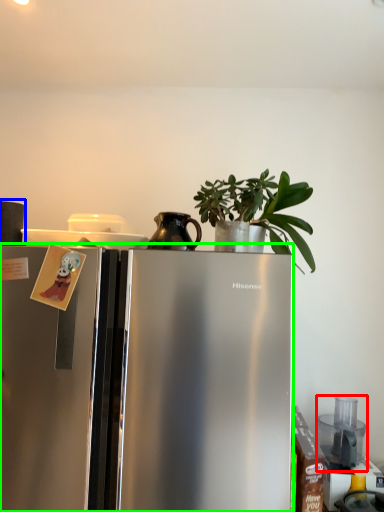
Question: Estimate the real-world distances between objects in this image. Which object is farther from appliance (highlighted by a red box), appliance (highlighted by a blue box) or refrigerator (highlighted by a green box)?

Choices:
 (A) appliance
 (B) refrigerator

Answer: (A)